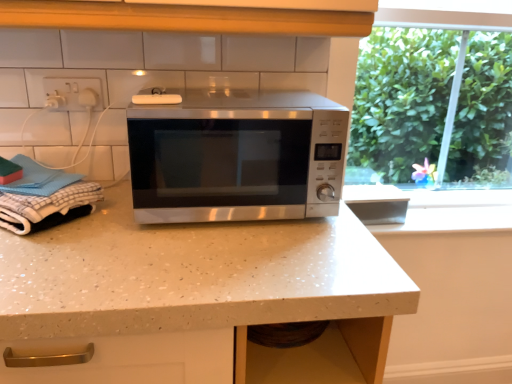
This screenshot has width=512, height=384. I want to click on white speckled laminate countertop at center, so click(192, 275).

At what (x,y) coordinates should I click in order to perform the action: click on white speckled laminate countertop at center. Please return your answer as a coordinate pair (x, y). The height and width of the screenshot is (384, 512). Looking at the image, I should click on (192, 275).

How distant is white speckled laminate countertop at center from white plastic socket at upper left?

white speckled laminate countertop at center and white plastic socket at upper left are 22.33 inches apart.

In the image, is white speckled laminate countertop at center positioned in front of or behind white plastic socket at upper left?

Clearly, white speckled laminate countertop at center is in front of white plastic socket at upper left.

Can you confirm if white speckled laminate countertop at center is smaller than white plastic socket at upper left?

No.

Is white speckled laminate countertop at center aimed at white plastic socket at upper left?

No.

Does white checkered cloth at left have a larger size compared to white speckled laminate countertop at center?

Incorrect, white checkered cloth at left is not larger than white speckled laminate countertop at center.

Which object is closer to the camera taking this photo, white checkered cloth at left or white speckled laminate countertop at center?

white speckled laminate countertop at center is closer to the camera.

Is point (35, 206) farther from viewer compared to point (274, 252)?

Yes, it is behind point (274, 252).

Which is in front, white speckled laminate countertop at center or stainless steel microwave at center?

white speckled laminate countertop at center is more forward.

Considering the relative positions of white speckled laminate countertop at center and stainless steel microwave at center in the image provided, is white speckled laminate countertop at center to the left of stainless steel microwave at center from the viewer's perspective?

Yes.

Consider the image. Is white speckled laminate countertop at center next to stainless steel microwave at center?

No, white speckled laminate countertop at center is not in contact with stainless steel microwave at center.

Consider the image. From the image's perspective, is stainless steel microwave at center above or below white checkered cloth at left?

stainless steel microwave at center is above white checkered cloth at left.

From a real-world perspective, who is located lower, stainless steel microwave at center or white checkered cloth at left?

white checkered cloth at left is physically lower.

Between point (327, 149) and point (28, 230), which one is positioned in front?

Point (28, 230)

Is stainless steel microwave at center positioned with its back to white checkered cloth at left?

No.

From the image's perspective, is white speckled laminate countertop at center under white checkered cloth at left?

Yes, from the image's perspective, white speckled laminate countertop at center is below white checkered cloth at left.

Is white speckled laminate countertop at center taller or shorter than white checkered cloth at left?

white speckled laminate countertop at center is taller than white checkered cloth at left.

What are the coordinates of `countertop to the right of white checkered cloth at left` in the screenshot? It's located at (192, 275).

Image resolution: width=512 pixels, height=384 pixels. Identify the location of microwave oven behind the white checkered cloth at left. click(x=237, y=158).

Looking at their sizes, would you say white checkered cloth at left is wider or thinner than stainless steel microwave at center?

Considering their sizes, white checkered cloth at left looks slimmer than stainless steel microwave at center.

Is white checkered cloth at left inside or outside of stainless steel microwave at center?

white checkered cloth at left exists outside the volume of stainless steel microwave at center.

Relative to stainless steel microwave at center, is white checkered cloth at left in front or behind?

Clearly, white checkered cloth at left is in front of stainless steel microwave at center.

Does stainless steel microwave at center have a greater width compared to white plastic socket at upper left?

Correct, the width of stainless steel microwave at center exceeds that of white plastic socket at upper left.

From the image's perspective, between stainless steel microwave at center and white plastic socket at upper left, which one is located above?

white plastic socket at upper left.

Considering the sizes of stainless steel microwave at center and white plastic socket at upper left in the image, is stainless steel microwave at center bigger or smaller than white plastic socket at upper left?

Clearly, stainless steel microwave at center is larger in size than white plastic socket at upper left.

Who is shorter, stainless steel microwave at center or white plastic socket at upper left?

white plastic socket at upper left.

Locate an element on the screen. The width and height of the screenshot is (512, 384). countertop in front of the white plastic socket at upper left is located at coordinates (192, 275).

This screenshot has height=384, width=512. Find the location of `countertop on the right side of white checkered cloth at left`. countertop on the right side of white checkered cloth at left is located at coordinates (192, 275).

Which object lies further to the anchor point white plastic socket at upper left, white checkered cloth at left or white speckled laminate countertop at center?

white speckled laminate countertop at center is positioned further to the anchor white plastic socket at upper left.

Looking at this image, which object lies further to the anchor point white checkered cloth at left, stainless steel microwave at center or white speckled laminate countertop at center?

stainless steel microwave at center is positioned further to the anchor white checkered cloth at left.

When comparing their distances from white plastic socket at upper left, does stainless steel microwave at center or white speckled laminate countertop at center seem further?

white speckled laminate countertop at center lies further to white plastic socket at upper left than the other object.

Considering their positions, is white speckled laminate countertop at center positioned further to white checkered cloth at left than white plastic socket at upper left?

white plastic socket at upper left lies further to white checkered cloth at left than the other object.

Estimate the real-world distances between objects in this image. Which object is further from white speckled laminate countertop at center, white checkered cloth at left or white plastic socket at upper left?

white plastic socket at upper left lies further to white speckled laminate countertop at center than the other object.

Which object lies further to the anchor point white speckled laminate countertop at center, stainless steel microwave at center or white checkered cloth at left?

Based on the image, white checkered cloth at left appears to be further to white speckled laminate countertop at center.

Estimate the real-world distances between objects in this image. Which object is further from stainless steel microwave at center, white plastic socket at upper left or white speckled laminate countertop at center?

white plastic socket at upper left.

When comparing their distances from white speckled laminate countertop at center, does white plastic socket at upper left or stainless steel microwave at center seem closer?

stainless steel microwave at center.

This screenshot has height=384, width=512. Identify the location of microwave oven between white plastic socket at upper left and white speckled laminate countertop at center from top to bottom. (237, 158).

Identify the location of laundry between white plastic socket at upper left and white speckled laminate countertop at center in the vertical direction. [x=45, y=198].

This screenshot has width=512, height=384. I want to click on electric outlet between white checkered cloth at left and stainless steel microwave at center from left to right, so click(x=73, y=93).

Locate an element on the screen. Image resolution: width=512 pixels, height=384 pixels. laundry between stainless steel microwave at center and white speckled laminate countertop at center vertically is located at coordinates (45, 198).